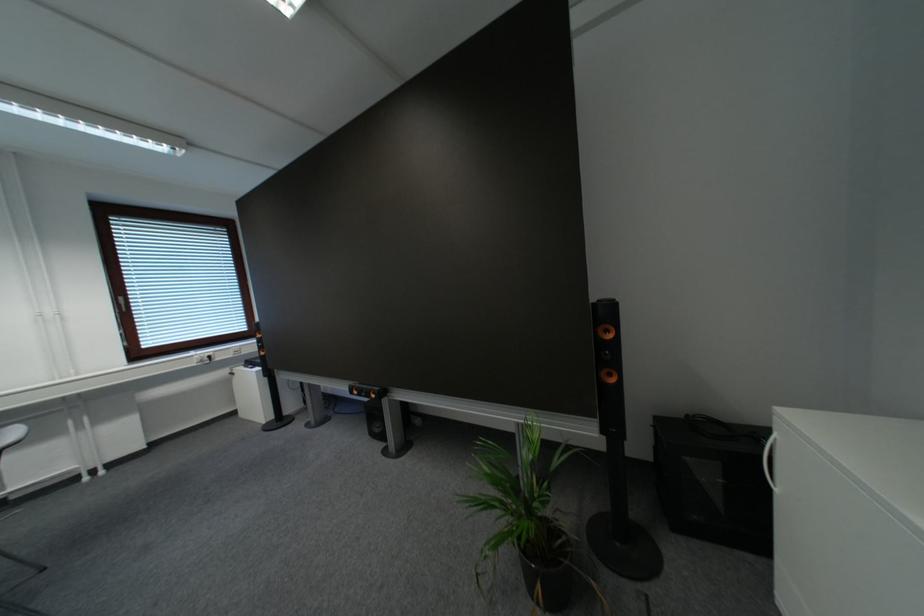
This screenshot has width=924, height=616. Describe the element at coordinates (123, 301) in the screenshot. I see `the brown window handle` at that location.